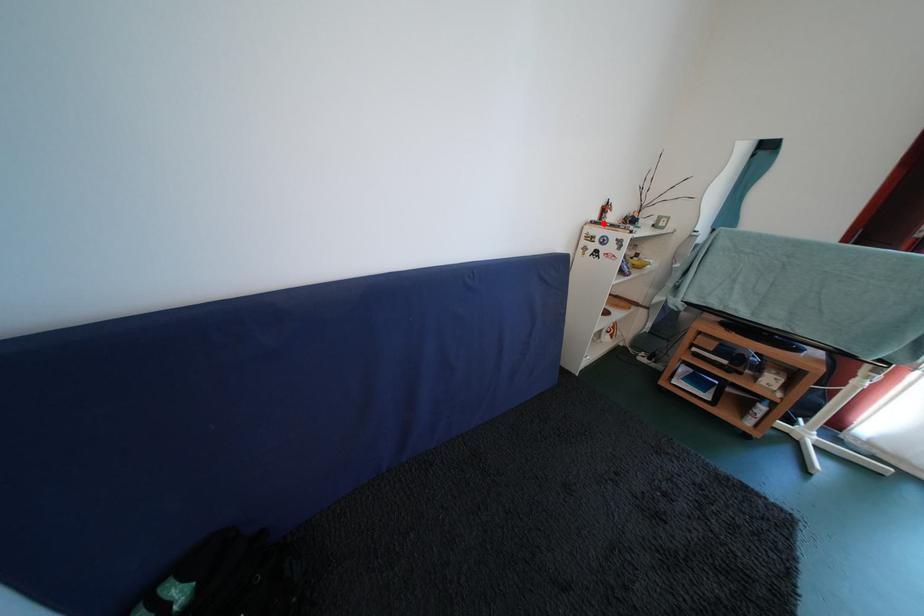
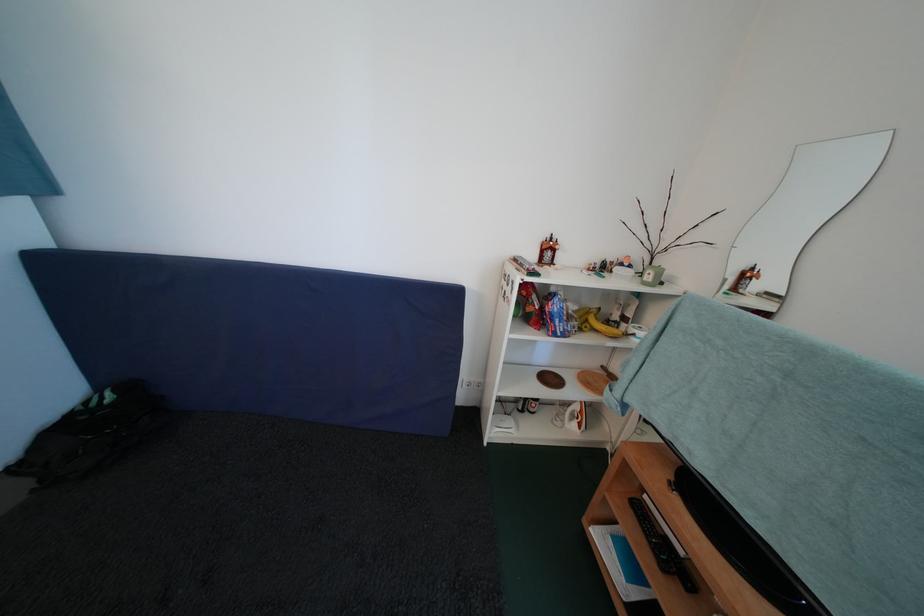
In the second image, find the point that corresponds to the highlighted location in the first image.

(539, 261)